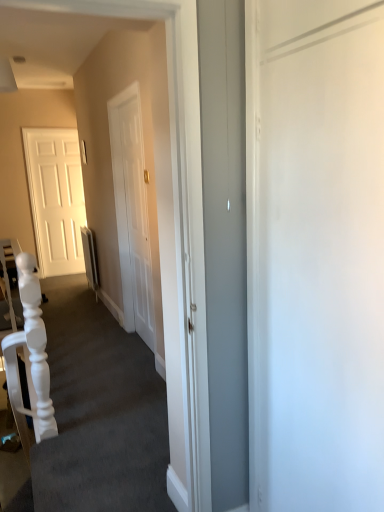
Question: From the image's perspective, is white glossy door at left located above or below white matte armchair at left?

Choices:
 (A) above
 (B) below

Answer: (A)

Question: Does point (26, 153) appear closer or farther from the camera than point (23, 303)?

Choices:
 (A) closer
 (B) farther

Answer: (B)

Question: Which object is positioned closest to the white matte armchair at left?

Choices:
 (A) white matte stairwell at center
 (B) white glossy door at left

Answer: (A)

Question: Which object is the farthest from the white glossy door at left?

Choices:
 (A) white matte armchair at left
 (B) white matte stairwell at center

Answer: (A)